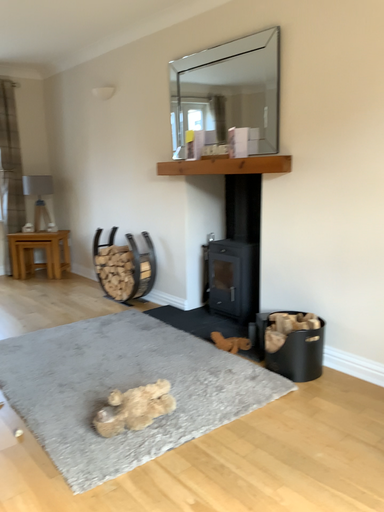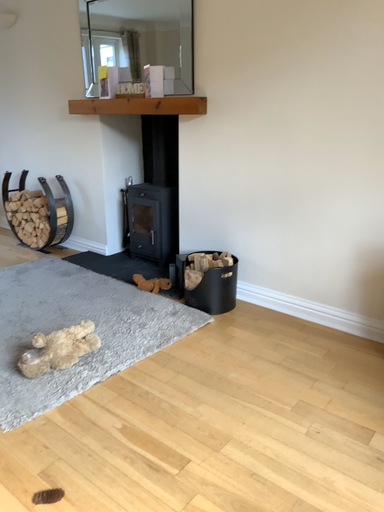
Question: How did the camera likely rotate when shooting the video?

Choices:
 (A) rotated upward
 (B) rotated downward

Answer: (B)